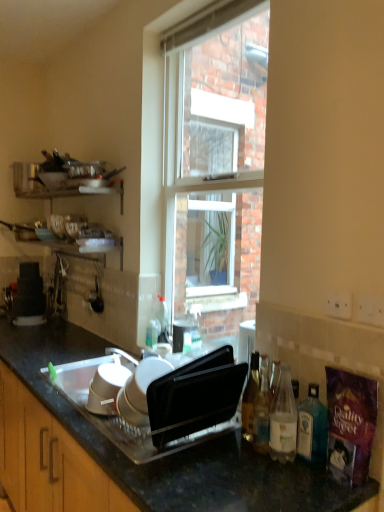
I want to click on vacant area that lies in front of translucent glass bottle at right, positioned as the fourth bottle in right-to-left order, so click(252, 467).